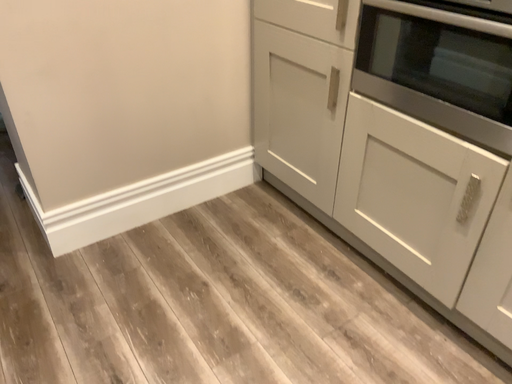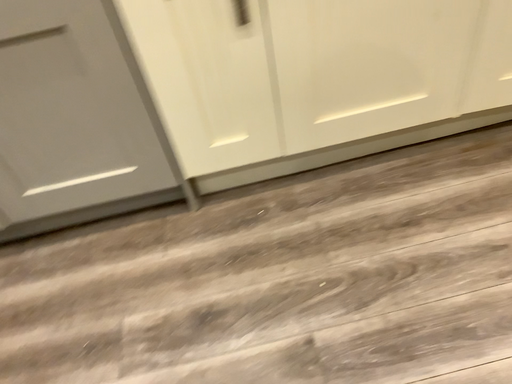
Question: Which way did the camera rotate in the video?

Choices:
 (A) rotated right
 (B) rotated left

Answer: (A)